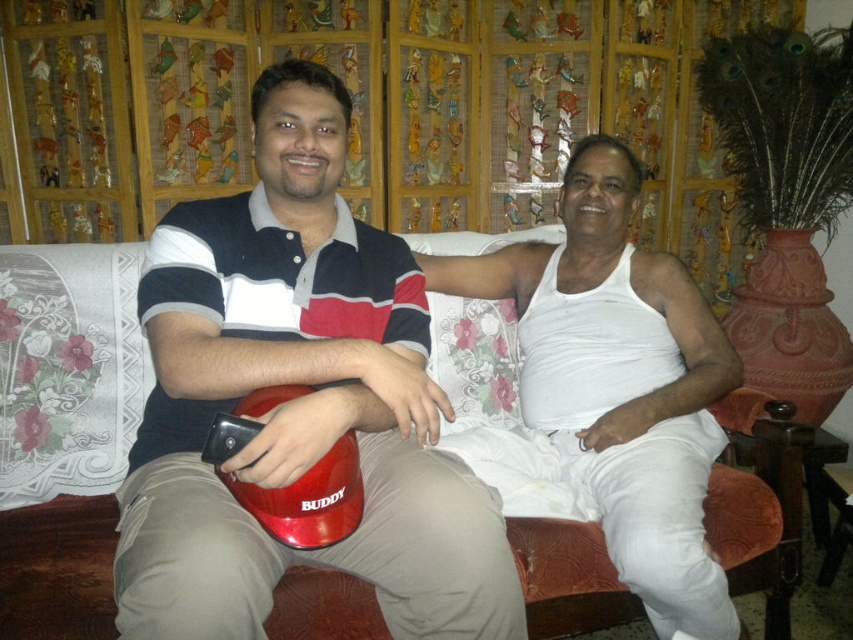
Question: Which object is farther from the camera taking this photo?

Choices:
 (A) white cotton tank top at center
 (B) matte plastic helmet at center
 (C) velvet-like orange couch at center

Answer: (A)

Question: Can you confirm if matte plastic helmet at center is positioned below white cotton tank top at center?

Choices:
 (A) no
 (B) yes

Answer: (A)

Question: Which point is farther to the camera?

Choices:
 (A) matte plastic helmet at center
 (B) velvet-like orange couch at center

Answer: (B)

Question: Which point appears closest to the camera in this image?

Choices:
 (A) (337, 376)
 (B) (548, 296)

Answer: (A)

Question: Does velvet-like orange couch at center have a lesser width compared to white cotton tank top at center?

Choices:
 (A) yes
 (B) no

Answer: (A)

Question: Does velvet-like orange couch at center have a smaller size compared to white cotton tank top at center?

Choices:
 (A) yes
 (B) no

Answer: (A)